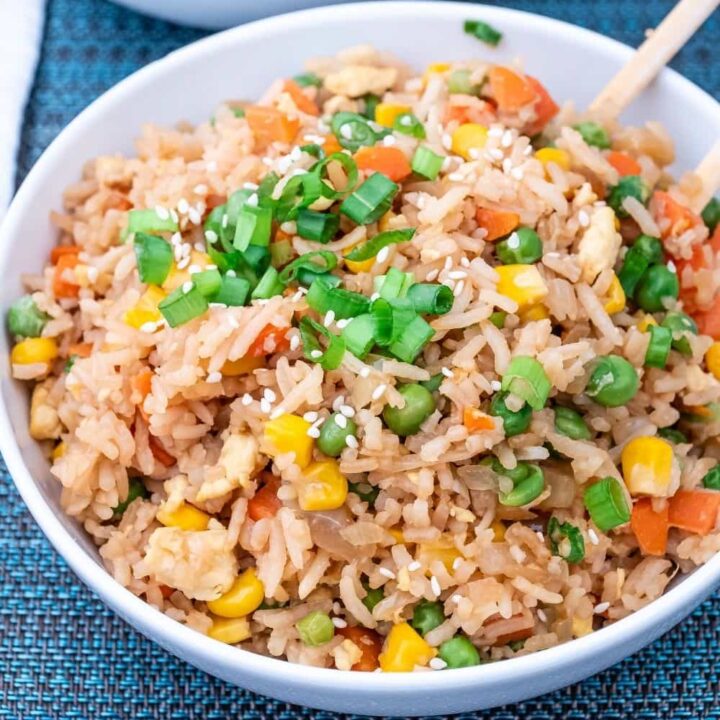
Where is `rim of white bowl`? This screenshot has width=720, height=720. rim of white bowl is located at coordinates (428, 675).